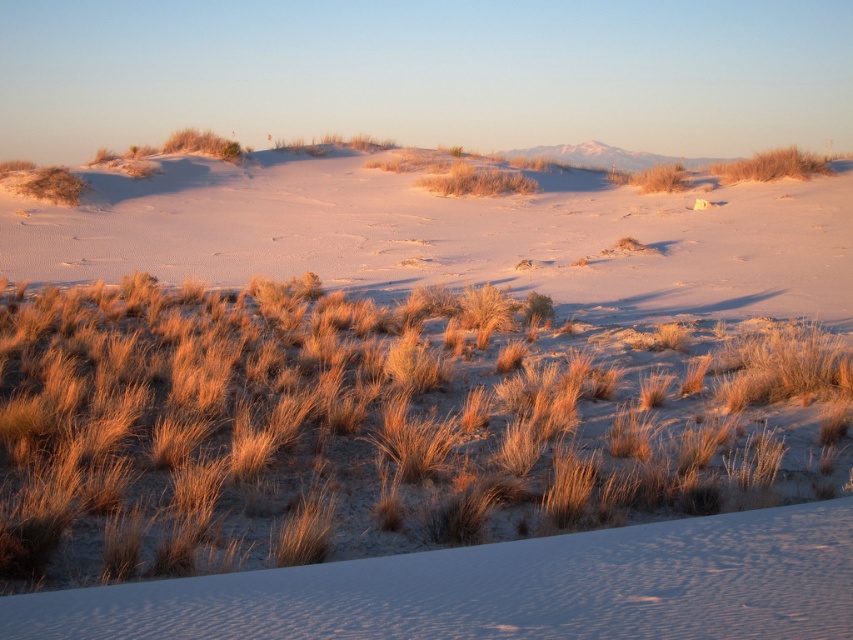
Question: Is dry grass at center wider than golden grass at upper center?

Choices:
 (A) yes
 (B) no

Answer: (B)

Question: Which of the following is the closest to the observer?

Choices:
 (A) dry grass at center
 (B) golden grass at upper center

Answer: (A)

Question: Is dry grass at center further to camera compared to golden grass at upper center?

Choices:
 (A) yes
 (B) no

Answer: (B)

Question: Which object is closer to the camera taking this photo?

Choices:
 (A) golden grass at upper center
 (B) dry grass at center

Answer: (B)

Question: Can you confirm if dry grass at center is wider than golden grass at upper center?

Choices:
 (A) no
 (B) yes

Answer: (A)